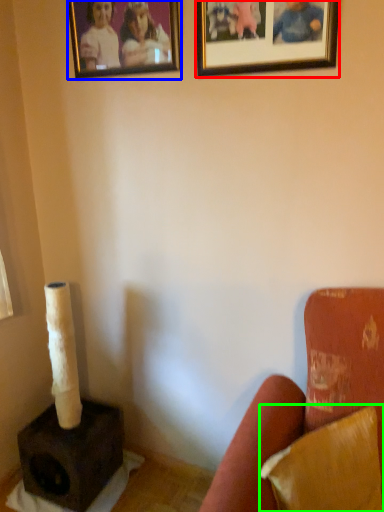
Question: Which object is positioned closest to picture frame (highlighted by a red box)? Select from picture frame (highlighted by a blue box) and pillow (highlighted by a green box).

Choices:
 (A) picture frame
 (B) pillow

Answer: (A)